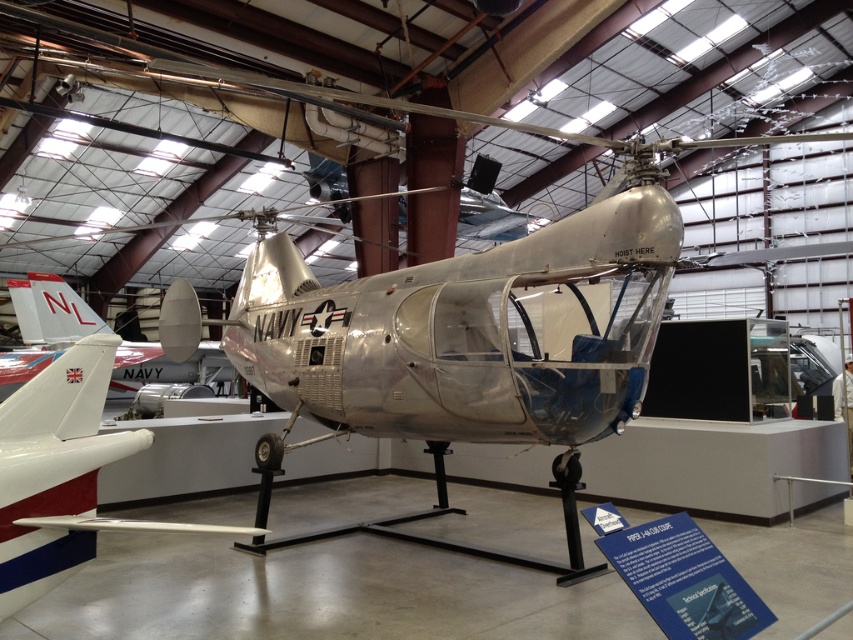
This screenshot has width=853, height=640. Describe the element at coordinates (61, 474) in the screenshot. I see `silver metallic helicopter at center` at that location.

Is silver metallic helicopter at center taller than silver metallic airplane at center?

No.

The height and width of the screenshot is (640, 853). What do you see at coordinates (61, 474) in the screenshot?
I see `silver metallic helicopter at center` at bounding box center [61, 474].

You are a GUI agent. You are given a task and a screenshot of the screen. Output one action in this format:
    pyautogui.click(x=<x>, y=<y>)
    Task: Click on the silver metallic helicopter at center
    Image resolution: width=853 pixels, height=640 pixels.
    Given the screenshot: What is the action you would take?
    pyautogui.click(x=61, y=474)